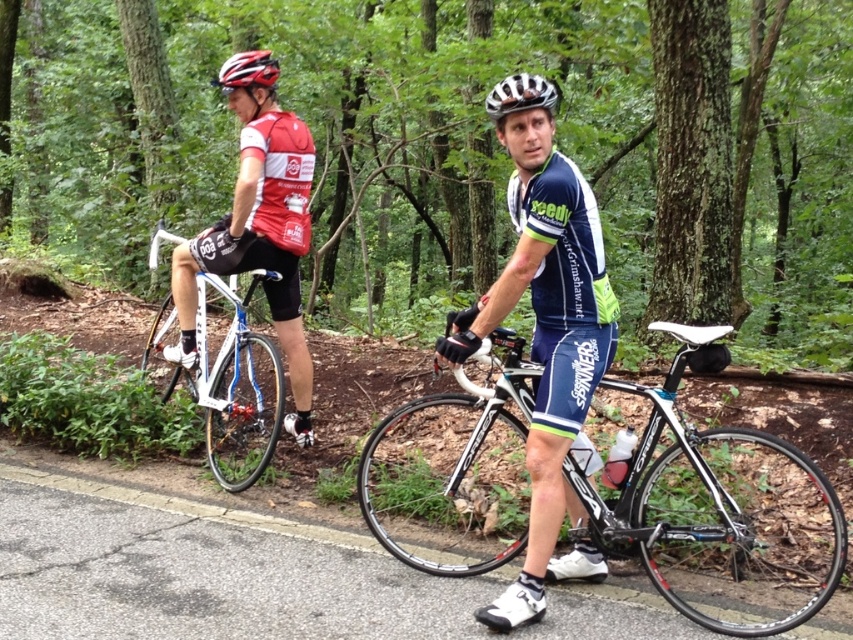
Question: Among these points, which one is farthest from the camera?

Choices:
 (A) (291, 332)
 (B) (271, 64)
 (C) (248, 352)
 (D) (369, 513)

Answer: (A)

Question: Can you confirm if matte red cycling jersey at left is thinner than white metallic bicycle at left?

Choices:
 (A) yes
 (B) no

Answer: (A)

Question: Based on their relative distances, which object is nearer to the white metallic bicycle at left?

Choices:
 (A) shiny multicolored helmet at upper center
 (B) shiny black frame at center

Answer: (B)

Question: Where is white matte bicycle helmet at center located in relation to shiny multicolored helmet at upper center in the image?

Choices:
 (A) below
 (B) above

Answer: (A)

Question: Is blue/white jersey at center smaller than white matte bicycle helmet at center?

Choices:
 (A) yes
 (B) no

Answer: (B)

Question: Which of the following is the closest to the observer?

Choices:
 (A) white metallic bicycle at left
 (B) shiny black frame at center
 (C) matte red cycling jersey at left
 (D) shiny multicolored helmet at upper center

Answer: (B)